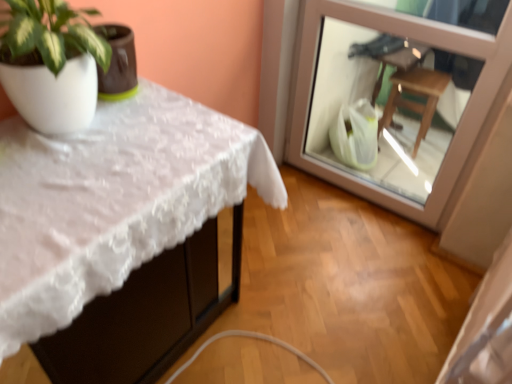
This screenshot has width=512, height=384. What are the coordinates of `free spot to the right of white lace tablecloth at upper left` in the screenshot? It's located at (297, 304).